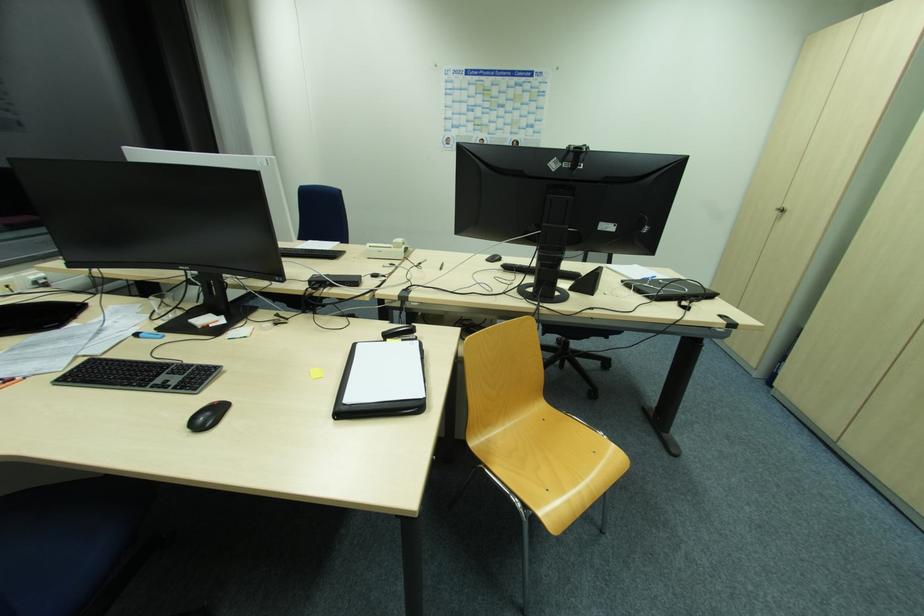
Locate an element on the screen. This screenshot has width=924, height=616. yellow chair sitting surface is located at coordinates (543, 452).